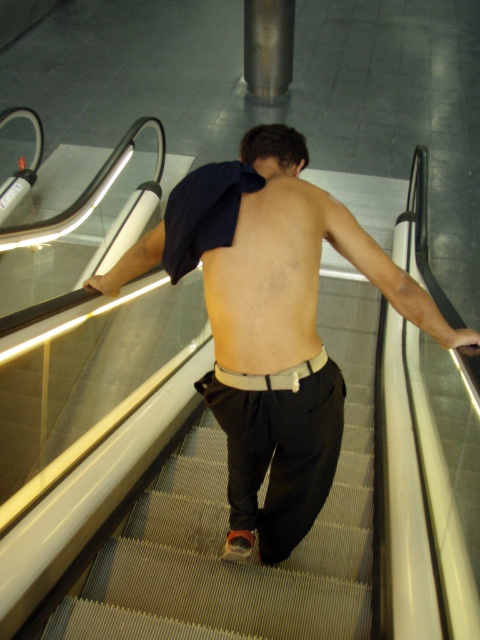
You are an observer standing at the bottom of the escalator and see both the matte black pants at center and the black cotton pants at center. Which pair of pants is more to the left?

The matte black pants at center is positioned on the left side of black cotton pants at center, so the matte black pants at center is more to the left.

You are an observer standing at the bottom of the escalator. You see the matte black pants at center and the skinny beige skin at back. Which object is positioned higher in the image?

The matte black pants at center is taller than the skinny beige skin at back, so the matte black pants at center is positioned higher in the image.

You are an observer standing at the bottom of the escalator. You see the skinny beige skin at back and the black cotton pants at center. Which one is shorter in height?

The skinny beige skin at back has a lesser height compared to the black cotton pants at center, so the skinny beige skin at back is shorter in height.